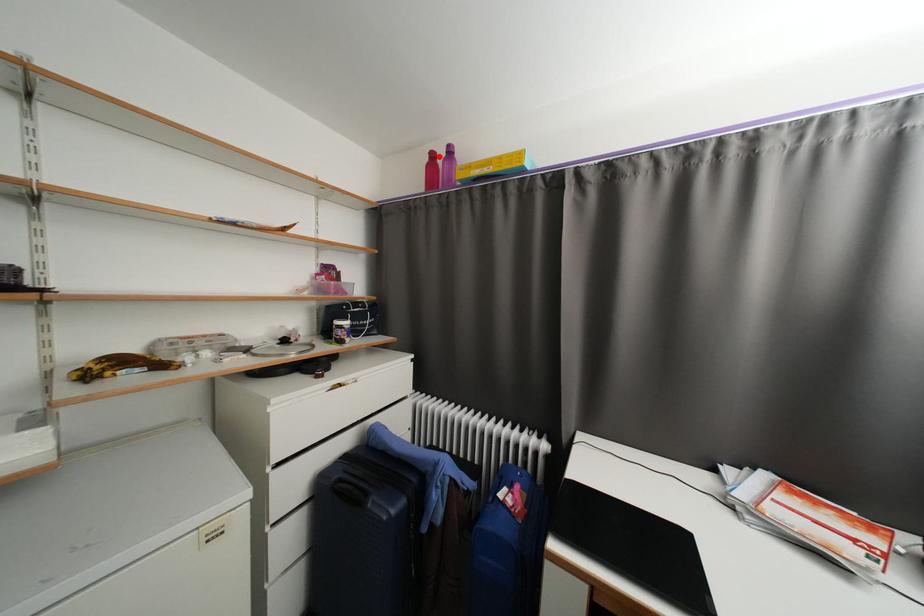
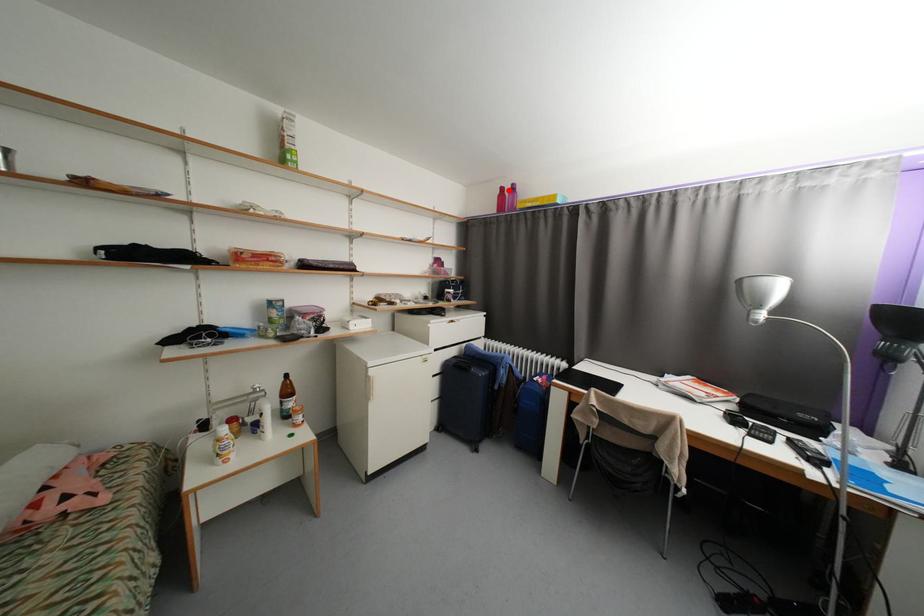
I am providing you with two images of the same scene from different viewpoints. A red point is marked on the first image and another point is marked on the second image. Is the red point in image1 aligned with the point shown in image2?

Yes